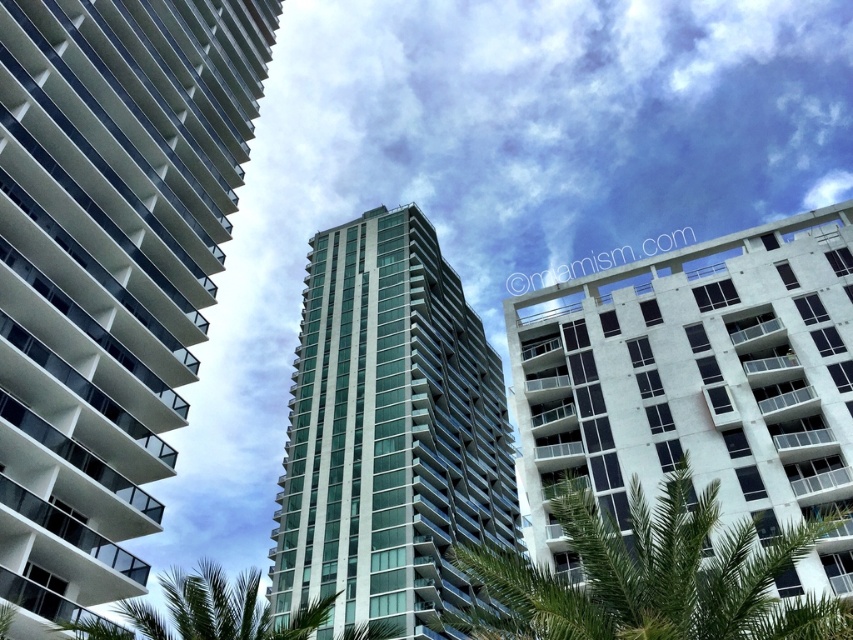
Question: Does white concrete building at right have a larger size compared to green glass building at center?

Choices:
 (A) yes
 (B) no

Answer: (B)

Question: Which point is closer to the camera?

Choices:
 (A) (102, 630)
 (B) (711, 568)

Answer: (B)

Question: Can you confirm if green glass building at center is wider than green leafy palm tree at lower center?

Choices:
 (A) no
 (B) yes

Answer: (A)

Question: Which point is closer to the camera?

Choices:
 (A) (117, 445)
 (B) (289, 538)
 (C) (251, 620)
 (D) (622, 275)

Answer: (C)

Question: Does green glass building at center appear on the left side of green leafy palm tree at lower center?

Choices:
 (A) yes
 (B) no

Answer: (B)

Question: Based on their relative distances, which object is nearer to the white glass building at left?

Choices:
 (A) green leafy palm tree at center
 (B) green glass building at center
 (C) white concrete building at right
 (D) green leafy palm tree at lower center

Answer: (D)